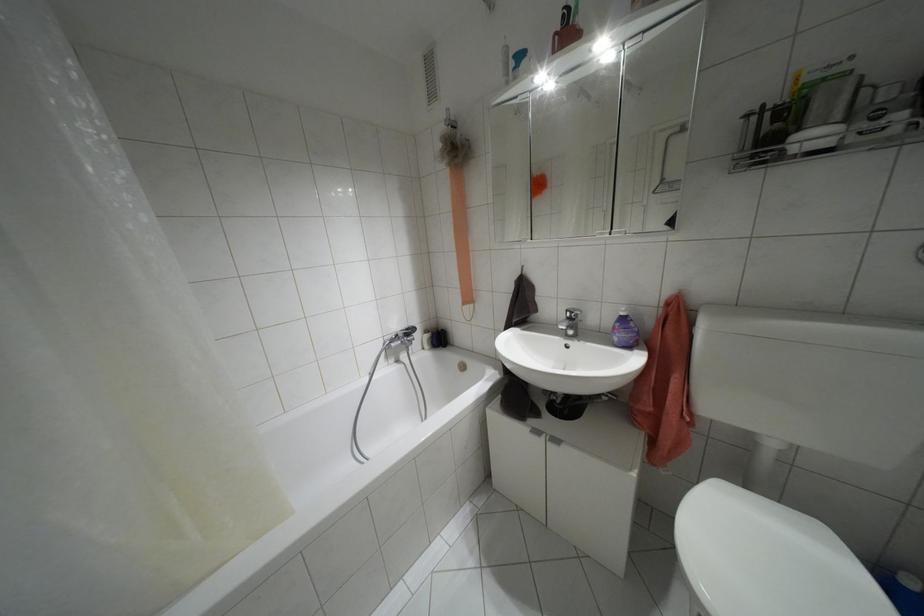
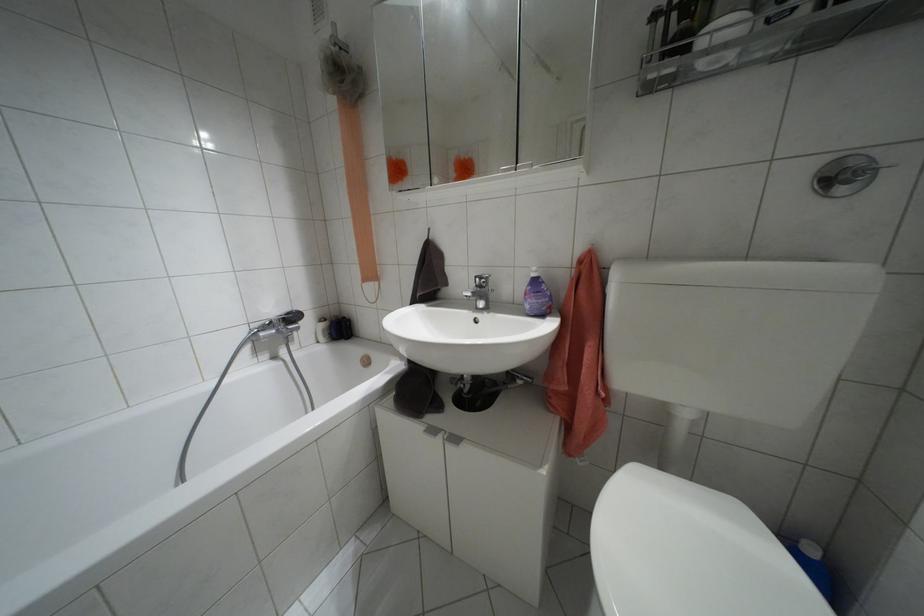
The point at (x=407, y=329) is marked in the first image. Where is the corresponding point in the second image?

(286, 313)